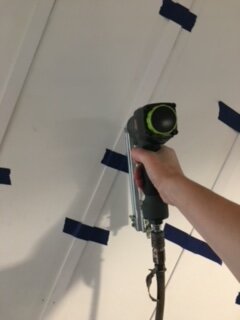
The image size is (240, 320). What are the coordinates of `wall molding` in the screenshot? It's located at (16, 88), (148, 93), (226, 150).